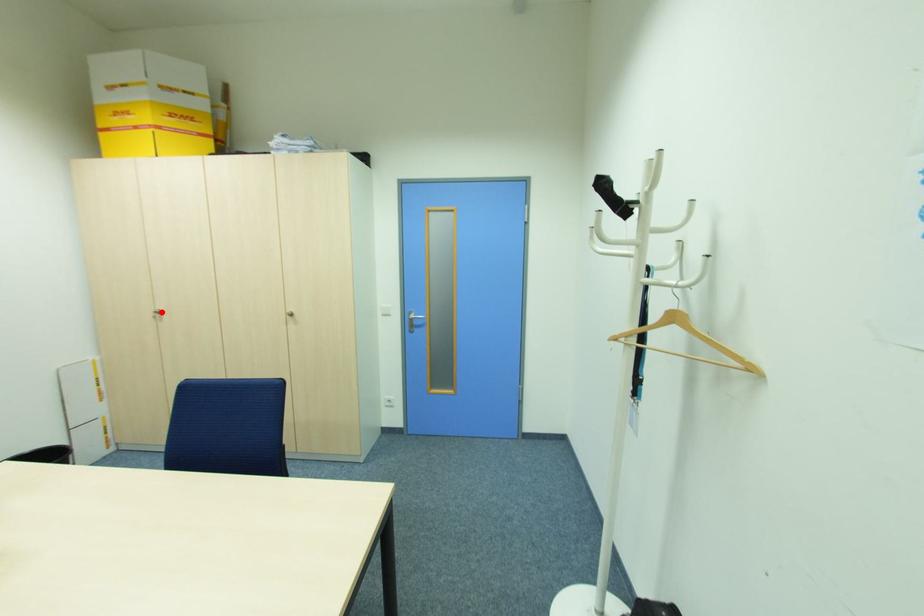
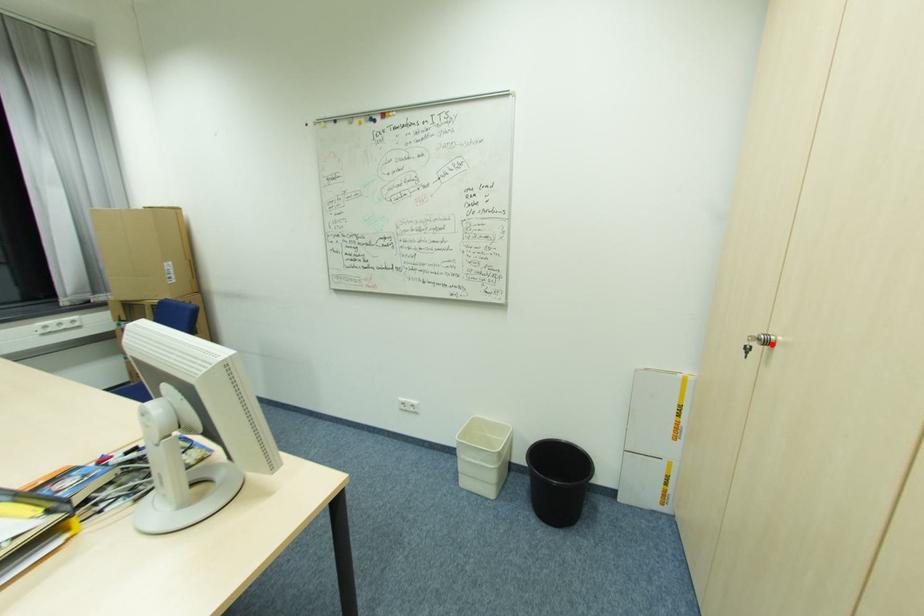
Looking at this image, I am providing you with two images of the same scene from different viewpoints. A red point is marked on the first image and another point is marked on the second image. Is the marked point in image1 the same physical position as the marked point in image2?

Yes